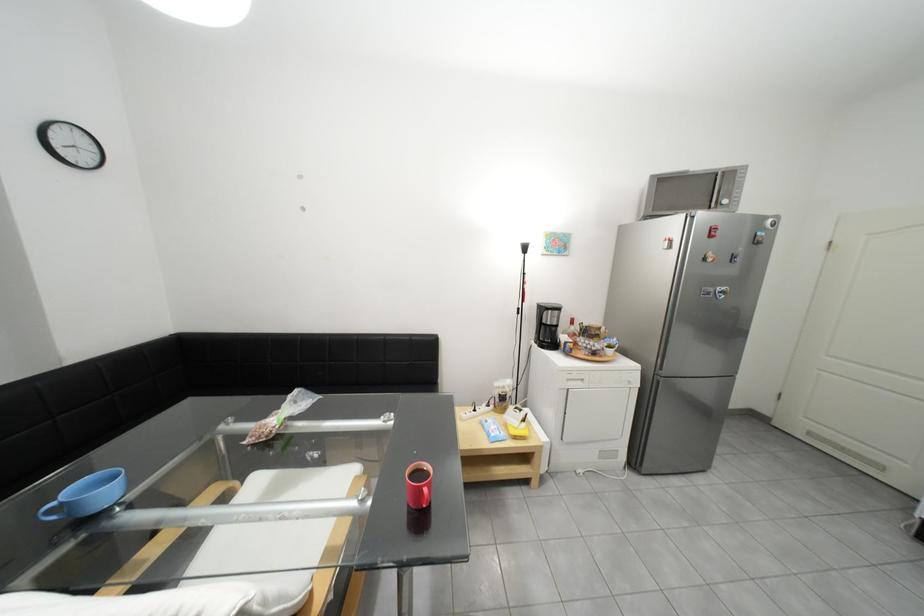
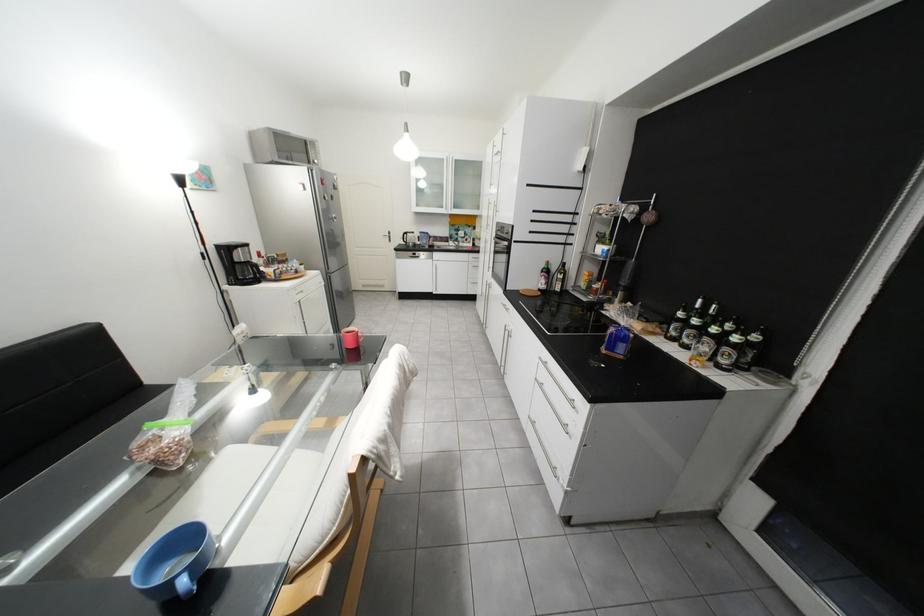
In the second image, find the point that corresponds to the point at 682,241 in the first image.

(315, 185)